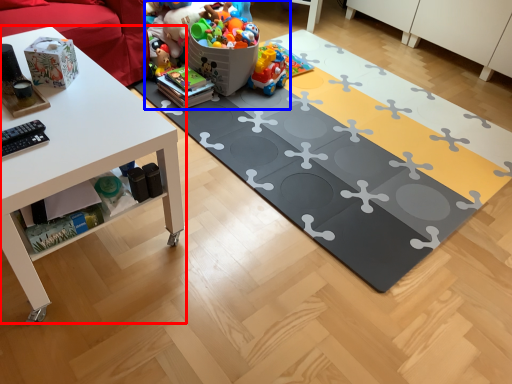
Question: Which object appears closest to the camera in this image, table (highlighted by a red box) or toy (highlighted by a blue box)?

Choices:
 (A) table
 (B) toy

Answer: (A)